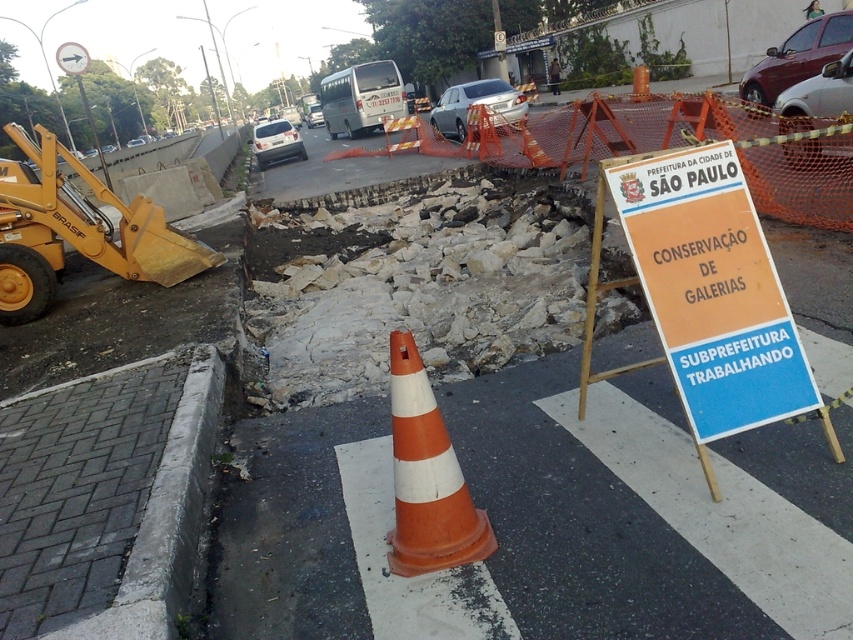
Based on the photo, you are a delivery driver approaching the construction site in the image. Your GPS indicates a potential route change. Based on the scene, where is the orange cardboard sign at center right located relative to the point marked by coordinates (705, 292)?

The orange cardboard sign at center right is located exactly at the point marked by coordinates (705, 292).

You are a delivery driver approaching the construction site. You see two points marked on the road ahead. The first point is at coordinate point[213,260] and the second is at point[451,512]. Which point is closer to your current position?

Point[213,260] is further to the camera than point[451,512], so the point closer to your current position is point[451,512].